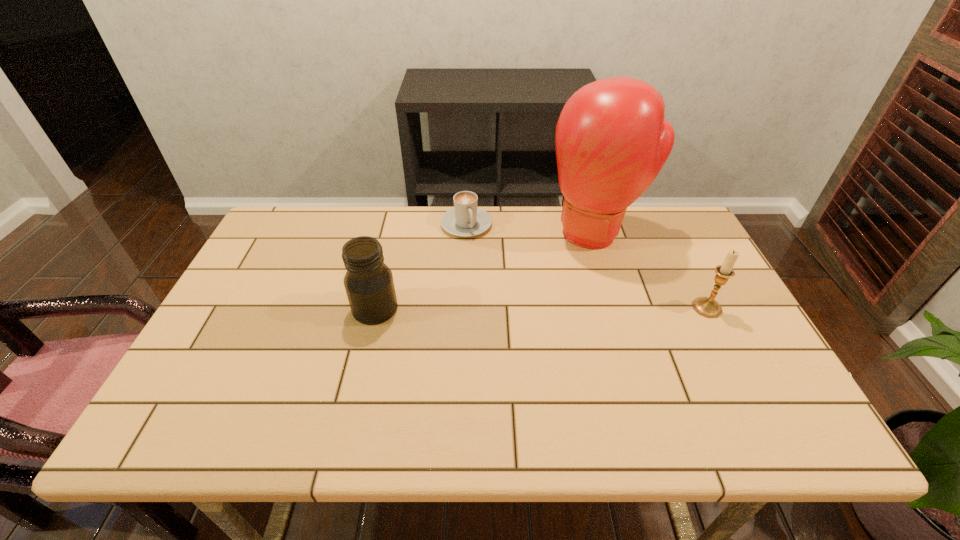
Where is `jar`? jar is located at coordinates (369, 285).

Where is `the rightmost object`? The height and width of the screenshot is (540, 960). the rightmost object is located at coordinates (708, 307).

Where is `the second object from left to right`? the second object from left to right is located at coordinates (465, 219).

Where is `cappuccino`? The width and height of the screenshot is (960, 540). cappuccino is located at coordinates (465, 219).

Identify the location of the second object from right to left. This screenshot has height=540, width=960. (611, 140).

At what (x,y) coordinates should I click in order to perform the action: click on the tallest object. Please return your answer as a coordinate pair (x, y). Looking at the image, I should click on (611, 140).

The image size is (960, 540). I want to click on free space located on the right of the leftmost object, so click(x=444, y=309).

Locate an element on the screen. The width and height of the screenshot is (960, 540). free spot located 0.160m on the front of the candle holder is located at coordinates (739, 370).

Image resolution: width=960 pixels, height=540 pixels. In order to click on vacant area situated 0.340m to the right of the shortest object in this screenshot , I will do point(511,318).

Identify the location of free region located to the right of the shortest object. click(x=499, y=294).